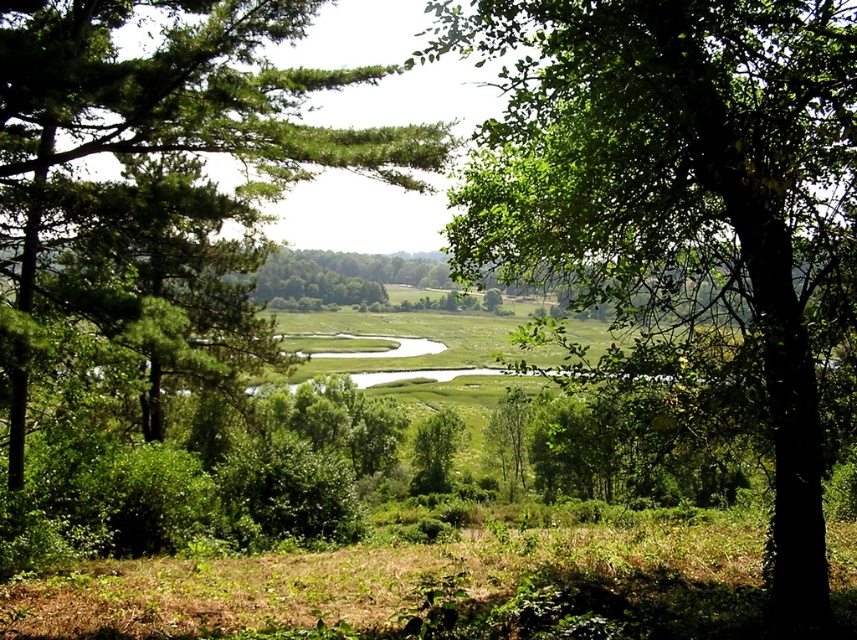
Does green leafy tree at center lie behind green leafy tree at left?

No, green leafy tree at center is in front of green leafy tree at left.

Does green leafy tree at center appear on the left side of green leafy tree at left?

In fact, green leafy tree at center is to the right of green leafy tree at left.

The height and width of the screenshot is (640, 857). Identify the location of green leafy tree at center. (682, 196).